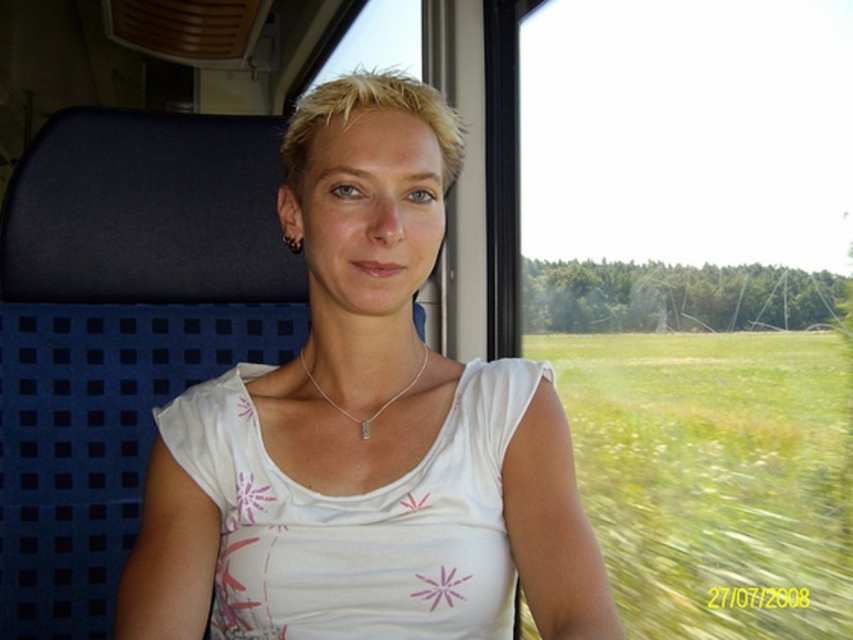
Is the position of white fabric at center less distant than that of silver metallic necklace at center?

Yes, it is in front of silver metallic necklace at center.

Does point (393, 465) lie in front of point (337, 404)?

That is True.

Describe the element at coordinates (357, 493) in the screenshot. Image resolution: width=853 pixels, height=640 pixels. I see `white fabric at center` at that location.

Locate an element on the screen. white fabric at center is located at coordinates (357, 493).